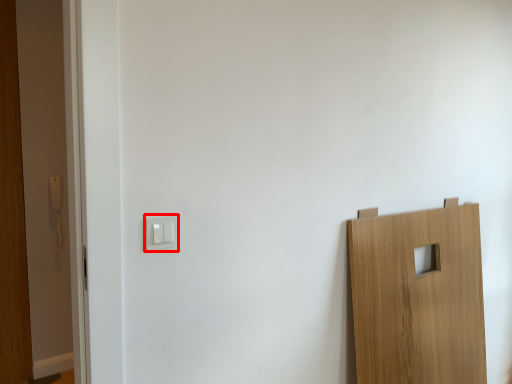
Question: From the image, what is the correct spatial relationship of light switch (annotated by the red box) in relation to light switch?

Choices:
 (A) right
 (B) left

Answer: (A)